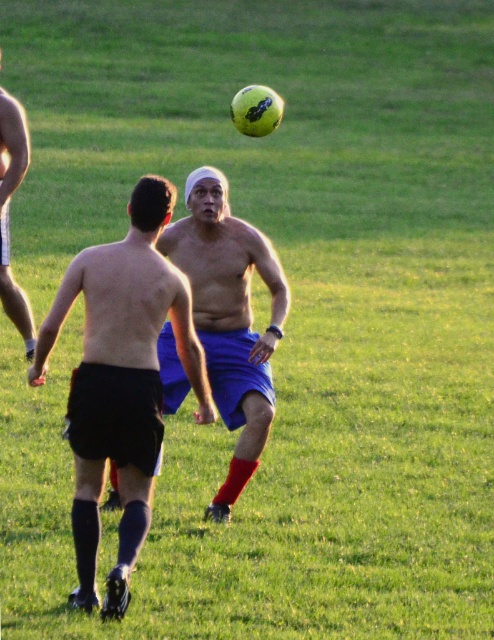
Question: Can you confirm if shiny blue shorts at center is wider than blue fabric shorts at center?

Choices:
 (A) no
 (B) yes

Answer: (B)

Question: Which object is closer to the camera taking this photo?

Choices:
 (A) shiny blue shorts at center
 (B) shiny black shorts at left
 (C) blue fabric shorts at center

Answer: (A)

Question: Does blue fabric shorts at center appear under shiny black shorts at left?

Choices:
 (A) yes
 (B) no

Answer: (A)

Question: Which object is positioned closest to the blue fabric shorts at center?

Choices:
 (A) shiny blue shorts at center
 (B) shiny black shorts at left

Answer: (A)

Question: Is blue fabric shorts at center closer to the viewer compared to shiny black shorts at left?

Choices:
 (A) no
 (B) yes

Answer: (B)

Question: Which of the following is the closest to the observer?

Choices:
 (A) blue fabric shorts at center
 (B) shiny black shorts at left

Answer: (A)